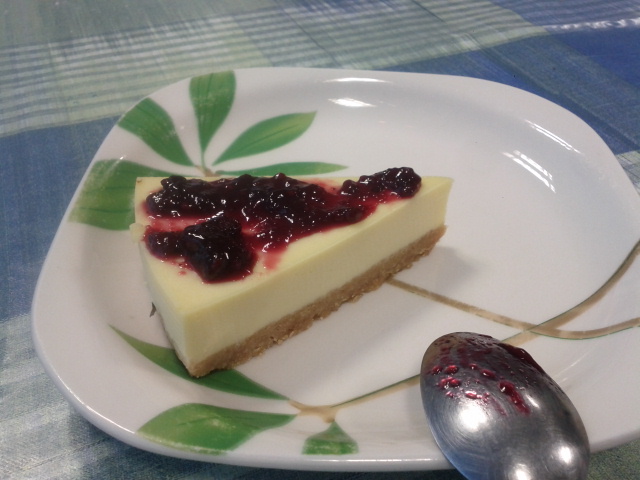
At what (x,y) coordinates should I click in order to perform the action: click on tablecloth. Please return your answer as a coordinate pair (x, y). Looking at the image, I should click on (594, 375), (582, 87).